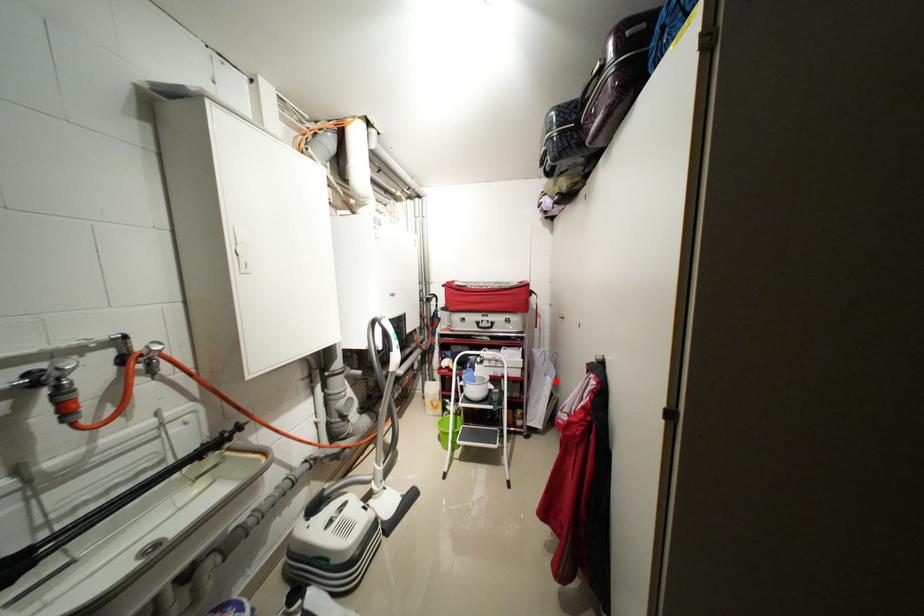
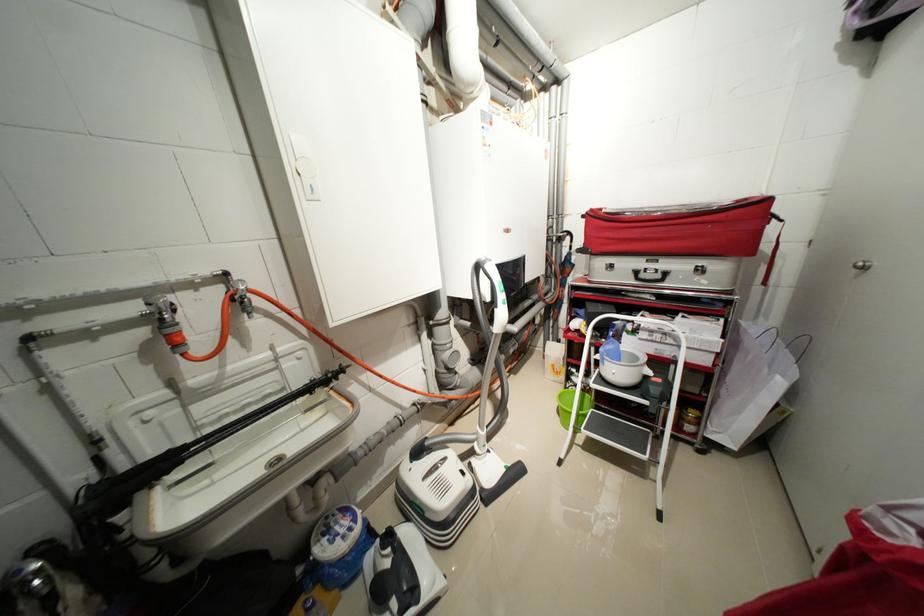
The point at the highlighted location is marked in the first image. Where is the corresponding point in the second image?

(787, 384)